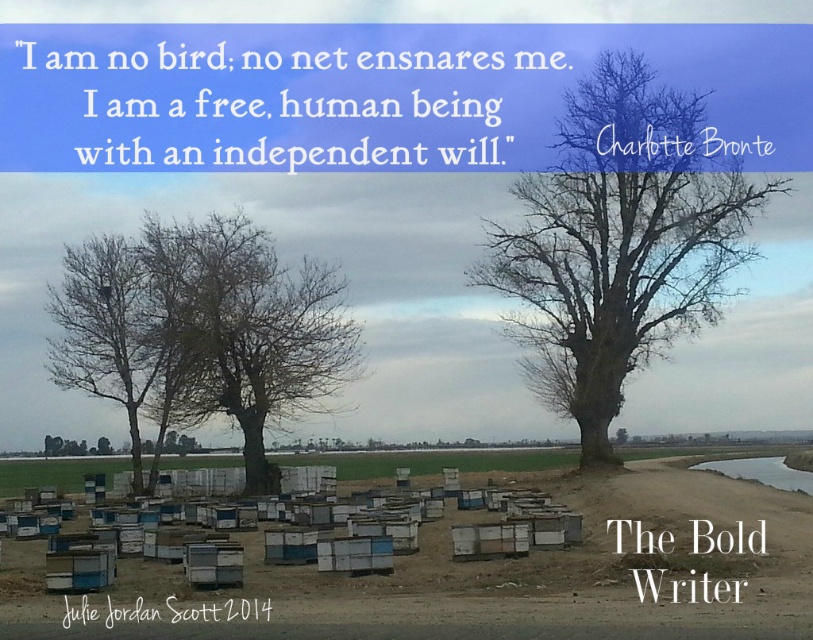
Does bare bark tree at right appear over bare wood tree at center?

Correct, bare bark tree at right is located above bare wood tree at center.

Is point (659, 336) more distant than point (174, 416)?

Yes, point (659, 336) is farther from viewer.

Measure the distance between bare bark tree at right and camera.

They are 54.01 meters apart.

The height and width of the screenshot is (640, 813). Find the location of `bare bark tree at right`. bare bark tree at right is located at coordinates (620, 241).